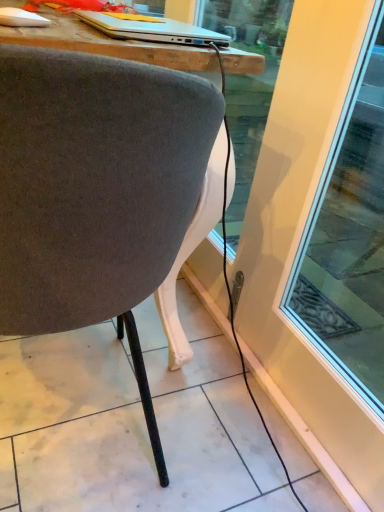
Question: Is velvet gray chair at center looking in the opposite direction of silver metallic laptop at upper center?

Choices:
 (A) yes
 (B) no

Answer: (B)

Question: Can you confirm if velvet gray chair at center is taller than silver metallic laptop at upper center?

Choices:
 (A) no
 (B) yes

Answer: (B)

Question: Would you say silver metallic laptop at upper center is part of velvet gray chair at center's contents?

Choices:
 (A) no
 (B) yes

Answer: (B)

Question: Can you confirm if velvet gray chair at center is thinner than silver metallic laptop at upper center?

Choices:
 (A) no
 (B) yes

Answer: (A)

Question: From a real-world perspective, is velvet gray chair at center on top of silver metallic laptop at upper center?

Choices:
 (A) no
 (B) yes

Answer: (A)

Question: Is velvet gray chair at center located outside silver metallic laptop at upper center?

Choices:
 (A) no
 (B) yes

Answer: (B)

Question: Does silver metallic laptop at upper center come in front of velvet gray chair at center?

Choices:
 (A) no
 (B) yes

Answer: (A)

Question: Is silver metallic laptop at upper center surrounding velvet gray chair at center?

Choices:
 (A) no
 (B) yes

Answer: (A)

Question: From a real-world perspective, is silver metallic laptop at upper center below velvet gray chair at center?

Choices:
 (A) yes
 (B) no

Answer: (B)

Question: Does silver metallic laptop at upper center have a lesser height compared to velvet gray chair at center?

Choices:
 (A) no
 (B) yes

Answer: (B)

Question: Considering the relative sizes of silver metallic laptop at upper center and velvet gray chair at center in the image provided, is silver metallic laptop at upper center wider than velvet gray chair at center?

Choices:
 (A) yes
 (B) no

Answer: (B)

Question: From the image's perspective, is silver metallic laptop at upper center under velvet gray chair at center?

Choices:
 (A) yes
 (B) no

Answer: (B)

Question: In the image, is velvet gray chair at center positioned in front of or behind silver metallic laptop at upper center?

Choices:
 (A) front
 (B) behind

Answer: (A)